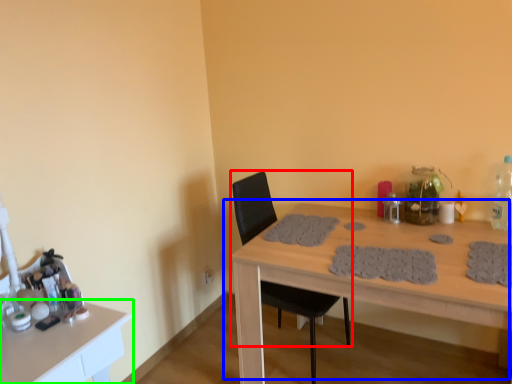
Question: Which object is positioned farthest from chair (highlighted by a red box)? Select from table (highlighted by a blue box) and table (highlighted by a green box).

Choices:
 (A) table
 (B) table

Answer: (B)